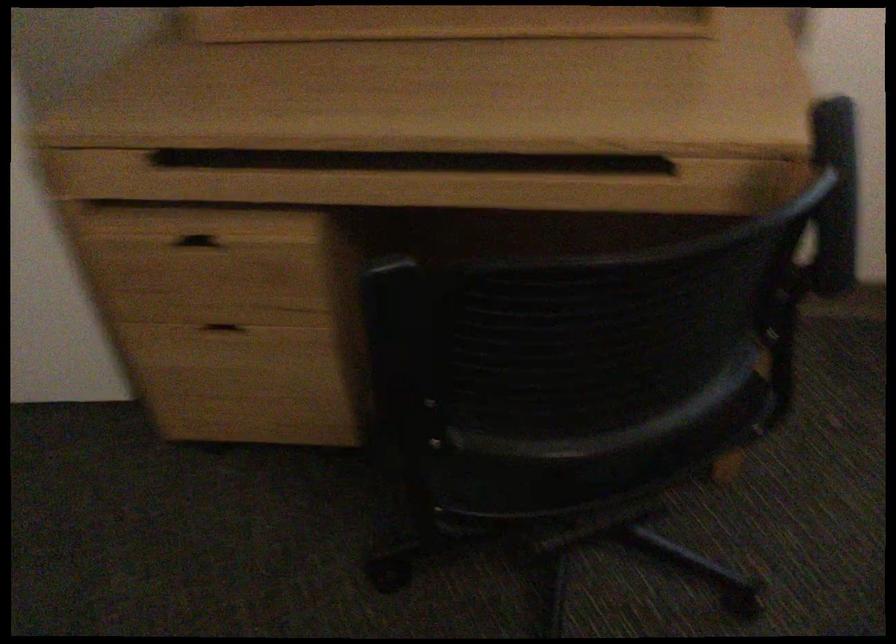
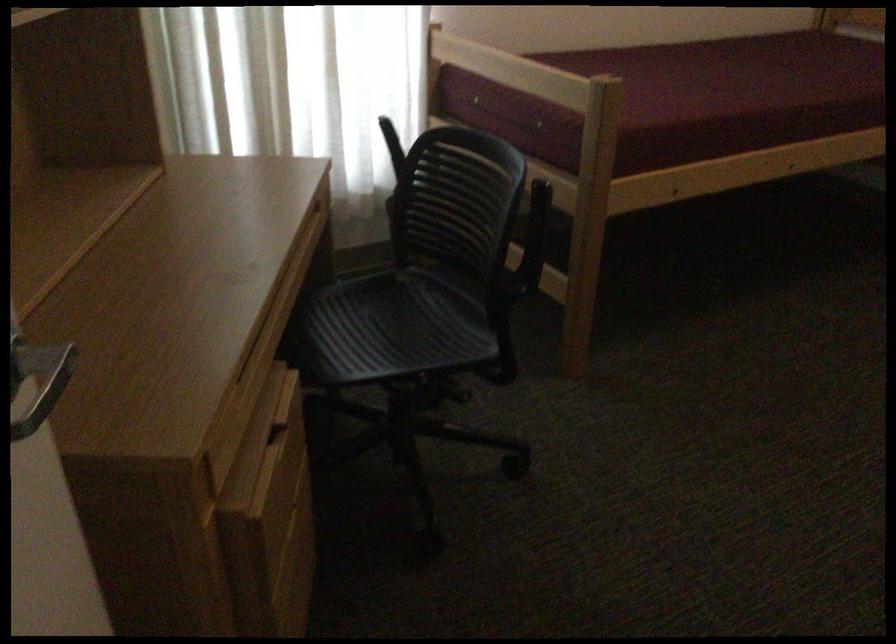
In the second image, find the point that corresponds to the point at 220,67 in the first image.

(55, 380)